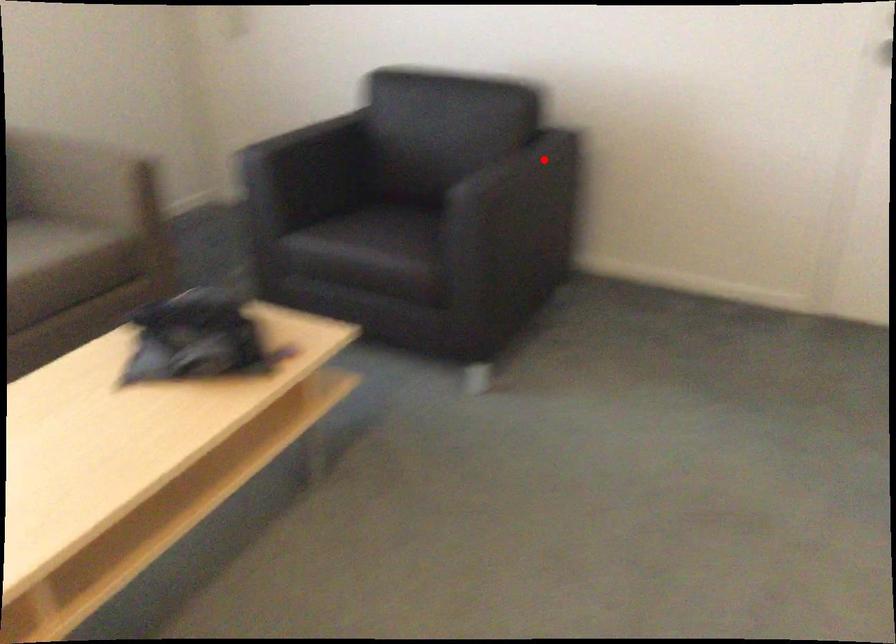
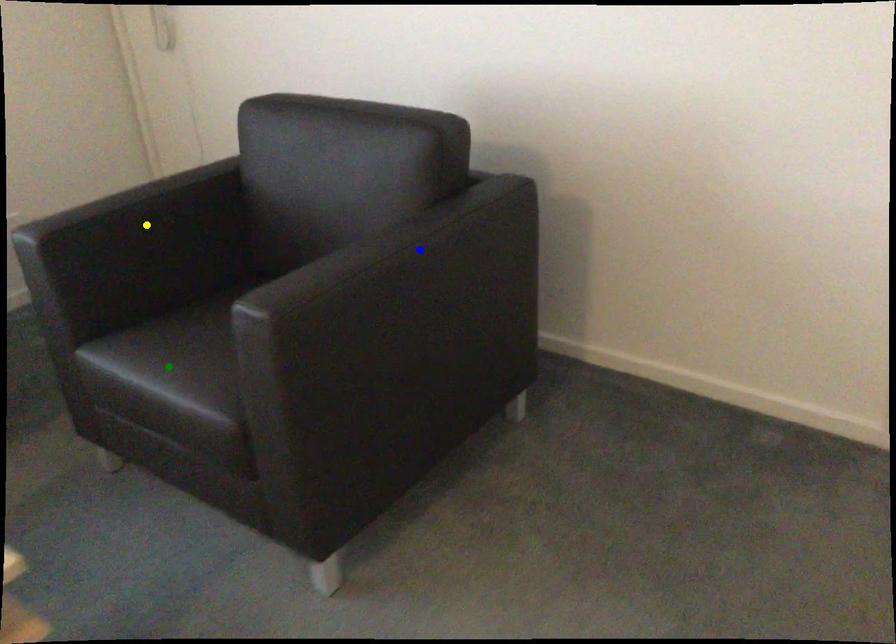
Question: I am providing you with two images of the same scene from different viewpoints. A red point is marked on the first image. You are given multiple points on the second image. Which point in image 2 represents the same 3d spot as the red point in image 1?

Choices:
 (A) yellow point
 (B) blue point
 (C) green point

Answer: (B)